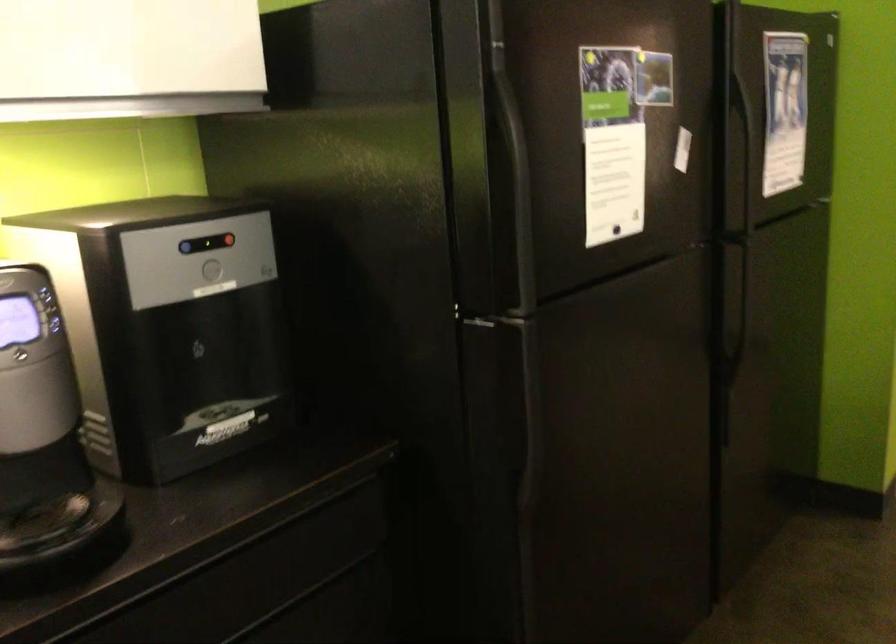
The image size is (896, 644). I want to click on blue dispenser button, so click(x=186, y=247).